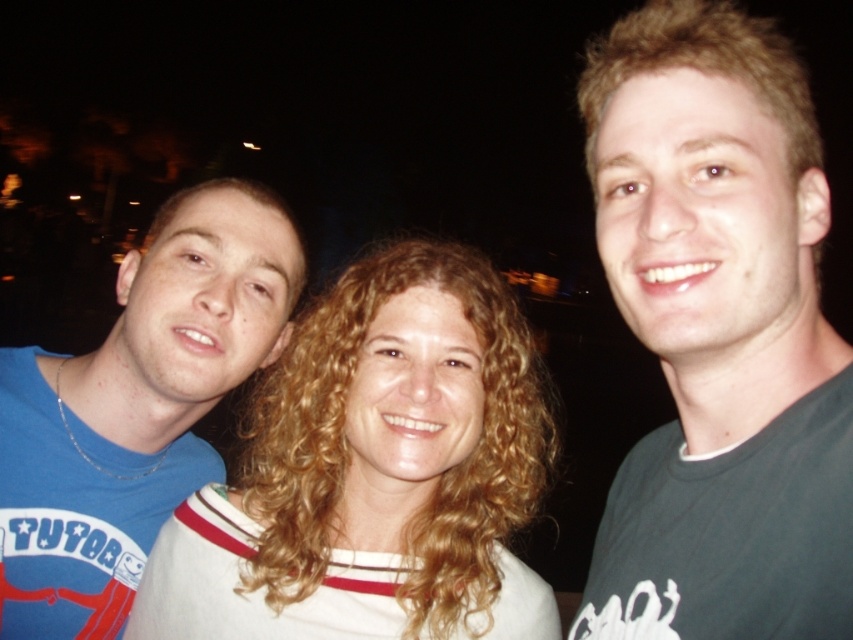
Who is higher up, dark green t-shirt at center or blue t-shirt at left?

dark green t-shirt at center is higher up.

Which of these two, dark green t-shirt at center or blue t-shirt at left, stands shorter?

With less height is blue t-shirt at left.

Identify the location of dark green t-shirt at center. (718, 336).

Who is lower down, curly blonde hair at center or blue t-shirt at left?

Positioned lower is curly blonde hair at center.

Does curly blonde hair at center have a lesser width compared to blue t-shirt at left?

Incorrect, curly blonde hair at center's width is not less than blue t-shirt at left's.

This screenshot has height=640, width=853. Describe the element at coordinates (375, 472) in the screenshot. I see `curly blonde hair at center` at that location.

What are the coordinates of `curly blonde hair at center` in the screenshot? It's located at (375, 472).

At what (x,y) coordinates should I click in order to perform the action: click on dark green t-shirt at center. Please return your answer as a coordinate pair (x, y). This screenshot has height=640, width=853. Looking at the image, I should click on (718, 336).

Is dark green t-shirt at center further to the viewer compared to blonde curly hair at right?

No, it is in front of blonde curly hair at right.

Image resolution: width=853 pixels, height=640 pixels. In order to click on dark green t-shirt at center in this screenshot , I will do `click(718, 336)`.

Find the location of `dark green t-shirt at center`. dark green t-shirt at center is located at coordinates (718, 336).